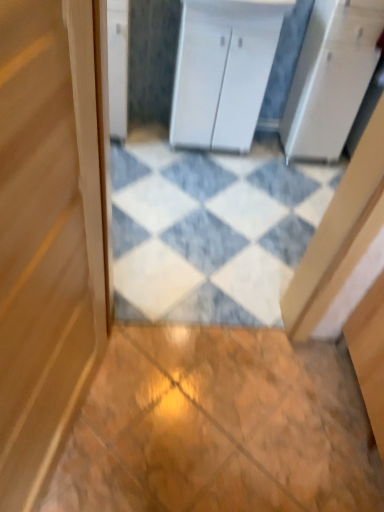
The width and height of the screenshot is (384, 512). What are the coordinates of `vacant space situated above white marble tile at center, arranged as the second tile when ordered from the bottom (from a real-world perspective)` in the screenshot? It's located at click(227, 207).